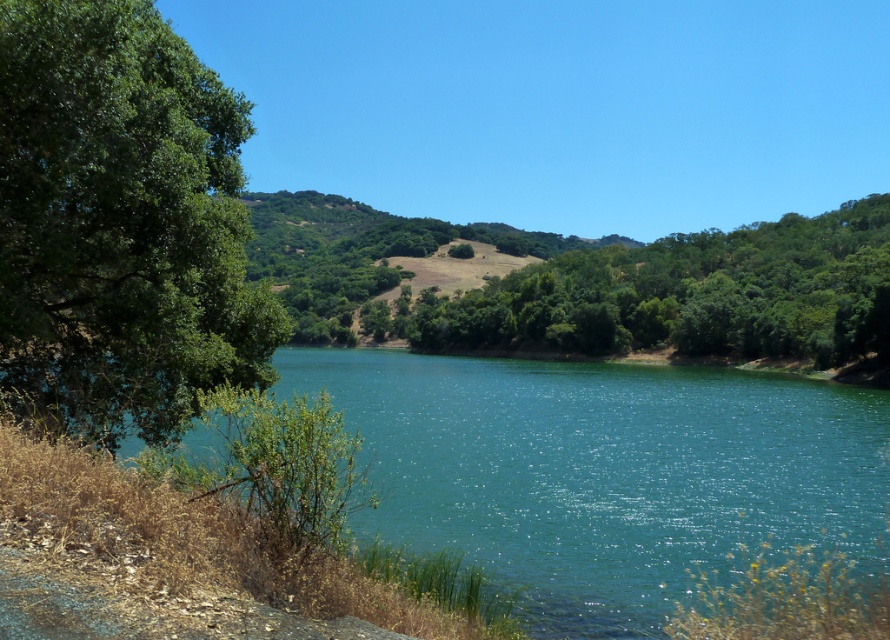
Question: Is green leafy tree at left smaller than green leafy hillside at center?

Choices:
 (A) no
 (B) yes

Answer: (B)

Question: Which point is closer to the camera?

Choices:
 (A) tap(310, 333)
 (B) tap(193, 362)
 (C) tap(712, 291)
 (D) tap(842, 477)

Answer: (B)

Question: Among these objects, which one is farthest from the camera?

Choices:
 (A) green leafy tree at left
 (B) teal glossy water at center

Answer: (A)

Question: Is teal glossy water at center to the left of green leafy tree at left from the viewer's perspective?

Choices:
 (A) yes
 (B) no

Answer: (B)

Question: Does green leafy tree at left come in front of green leafy hillside at center?

Choices:
 (A) yes
 (B) no

Answer: (A)

Question: Which is farther from the green leafy tree at center?

Choices:
 (A) green leafy tree at left
 (B) teal glossy water at center

Answer: (A)